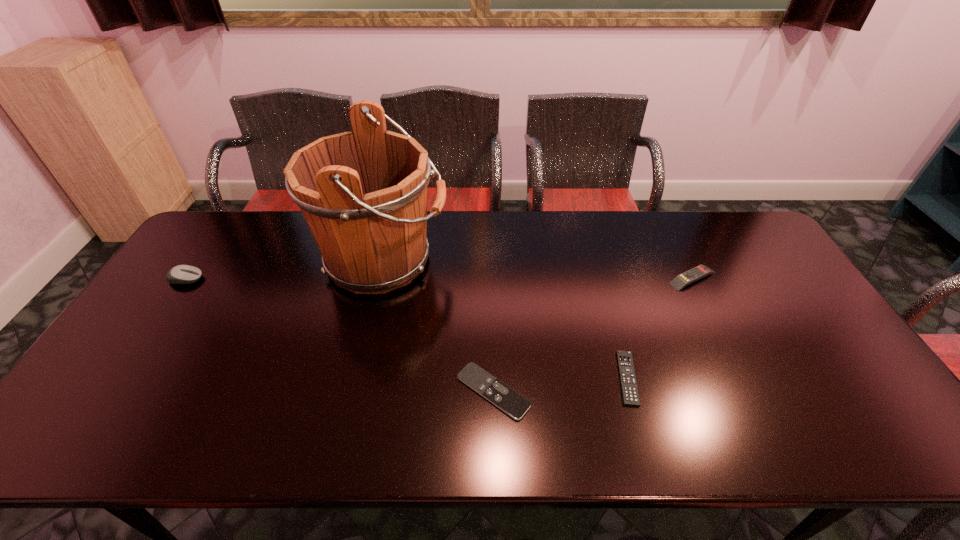
Choose which object is the fourth nearest neighbor to the second remote control from left to right. Please provide its 2D coordinates. Your answer should be formatted as a tuple, i.e. [(x, y)], where the tuple contains the x and y coordinates of a point satisfying the conditions above.

[(182, 274)]

Locate an element on the screen. object that stands as the third closest to the second remote control from right to left is located at coordinates [x=363, y=193].

Where is `remote control that stands as the third closest to the computer equipment`? This screenshot has width=960, height=540. remote control that stands as the third closest to the computer equipment is located at coordinates (679, 282).

This screenshot has width=960, height=540. Identify the location of remote control that stands as the closest to the third object from left to right. (630, 395).

At what (x,y) coordinates should I click in order to perform the action: click on vacant area in the image that satisfies the following two spatial constraints: 1. on the wheel side of the second tallest object; 2. on the right side of the second remote control from left to right. Please return your answer as a coordinate pair (x, y). Looking at the image, I should click on (118, 378).

This screenshot has width=960, height=540. Find the location of `free space that satisfies the following two spatial constraints: 1. on the back side of the leftmost remote control; 2. on the right side of the rightmost remote control`. free space that satisfies the following two spatial constraints: 1. on the back side of the leftmost remote control; 2. on the right side of the rightmost remote control is located at coordinates (491, 278).

Find the location of `free spot that satisfies the following two spatial constraints: 1. on the back side of the farthest remote control; 2. with the handle on the side of the tallest object`. free spot that satisfies the following two spatial constraints: 1. on the back side of the farthest remote control; 2. with the handle on the side of the tallest object is located at coordinates (684, 260).

In order to click on vacant point that satisfies the following two spatial constraints: 1. on the back side of the third object from left to right; 2. with the handle on the side of the tallest object in this screenshot , I will do pyautogui.click(x=490, y=260).

You are a GUI agent. You are given a task and a screenshot of the screen. Output one action in this format:
    pyautogui.click(x=<x>, y=<y>)
    Task: Click on the vacant region that satisfies the following two spatial constraints: 1. on the back side of the leftmost remote control; 2. with the handle on the side of the second object from left to right
    This screenshot has width=960, height=540.
    Given the screenshot: What is the action you would take?
    pyautogui.click(x=490, y=260)

You are a GUI agent. You are given a task and a screenshot of the screen. Output one action in this format:
    pyautogui.click(x=<x>, y=<y>)
    Task: Click on the free space in the image that satisfies the following two spatial constraints: 1. with the handle on the side of the rightmost object; 2. on the right side of the tallest object
    This screenshot has height=540, width=960.
    Given the screenshot: What is the action you would take?
    pyautogui.click(x=379, y=278)